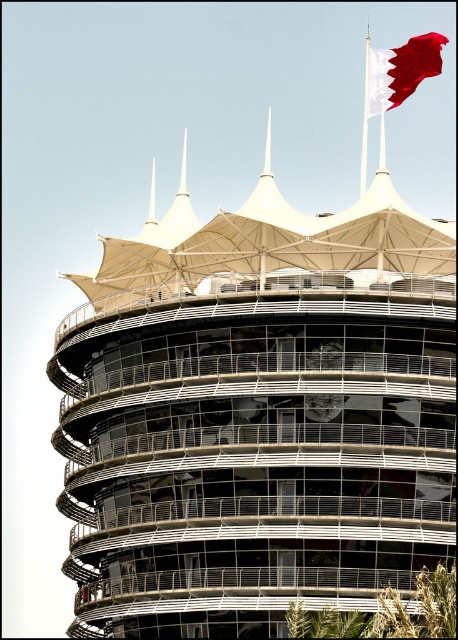
Which is behind, point (250, 568) or point (419, 48)?

The point (419, 48) is behind.

Which of these two, white glass tower at center or white fabric flag at upper right, stands taller?

white glass tower at center is taller.

Which is behind, point (239, 292) or point (408, 52)?

Point (408, 52)

Identify the location of white glass tower at center. (257, 417).